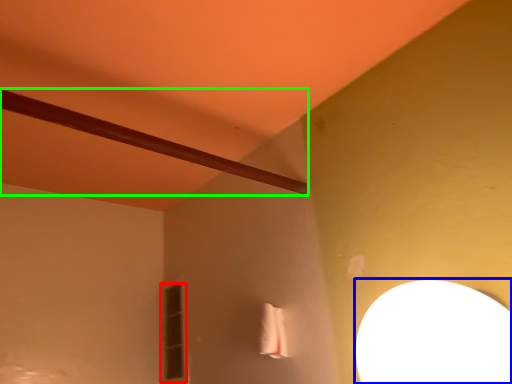
Question: Which object is positioned farthest from window (highlighted by a red box)? Select from lamp (highlighted by a blue box) and beam (highlighted by a green box).

Choices:
 (A) lamp
 (B) beam

Answer: (A)